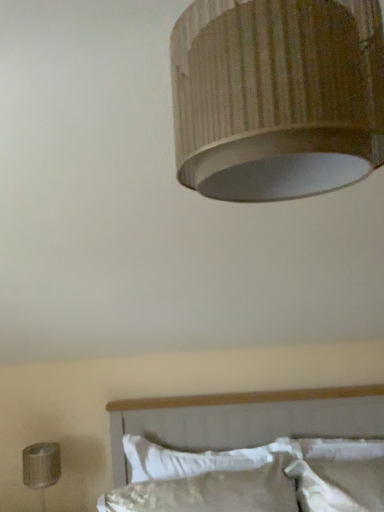
Question: Does white textured bed at lower center have a lesser width compared to white soft pillow at lower center?

Choices:
 (A) no
 (B) yes

Answer: (A)

Question: Would you say white textured bed at lower center is a long distance from white soft pillow at lower center?

Choices:
 (A) no
 (B) yes

Answer: (A)

Question: Is white soft pillow at lower center inside white textured bed at lower center?

Choices:
 (A) yes
 (B) no

Answer: (B)

Question: From the image's perspective, would you say white textured bed at lower center is shown under white soft pillow at lower center?

Choices:
 (A) yes
 (B) no

Answer: (B)

Question: Is white textured bed at lower center taller than white soft pillow at lower center?

Choices:
 (A) yes
 (B) no

Answer: (A)

Question: In terms of height, does wooden textured lampshade at upper center, the first lamp viewed from the front, look taller or shorter compared to metallic silver lamp at lower left, placed as the 2th lamp when sorted from right to left?

Choices:
 (A) tall
 (B) short

Answer: (A)

Question: From a real-world perspective, is wooden textured lampshade at upper center, positioned as the second lamp in bottom-to-top order, positioned above or below metallic silver lamp at lower left, the first lamp in the bottom-to-top sequence?

Choices:
 (A) below
 (B) above

Answer: (B)

Question: Is wooden textured lampshade at upper center, positioned as the second lamp in bottom-to-top order, to the left or to the right of metallic silver lamp at lower left, the second lamp in the top-to-bottom sequence, in the image?

Choices:
 (A) right
 (B) left

Answer: (A)

Question: Looking at the image, does wooden textured lampshade at upper center, positioned as the second lamp in bottom-to-top order, seem bigger or smaller compared to metallic silver lamp at lower left, the 2th lamp in the front-to-back sequence?

Choices:
 (A) small
 (B) big

Answer: (B)

Question: From their relative heights in the image, would you say white textured bed at lower center is taller or shorter than white soft pillow at lower center?

Choices:
 (A) short
 (B) tall

Answer: (B)

Question: Relative to white soft pillow at lower center, is white textured bed at lower center in front or behind?

Choices:
 (A) behind
 (B) front

Answer: (B)

Question: From a real-world perspective, is white textured bed at lower center positioned above or below white soft pillow at lower center?

Choices:
 (A) above
 (B) below

Answer: (A)

Question: Considering the positions of white textured bed at lower center and white soft pillow at lower center in the image, is white textured bed at lower center wider or thinner than white soft pillow at lower center?

Choices:
 (A) wide
 (B) thin

Answer: (A)

Question: From a real-world perspective, is white soft pillow at lower center above or below metallic silver lamp at lower left, arranged as the first lamp when viewed from the back?

Choices:
 (A) below
 (B) above

Answer: (B)

Question: Relative to metallic silver lamp at lower left, the second lamp in the top-to-bottom sequence, is white soft pillow at lower center in front or behind?

Choices:
 (A) behind
 (B) front

Answer: (A)